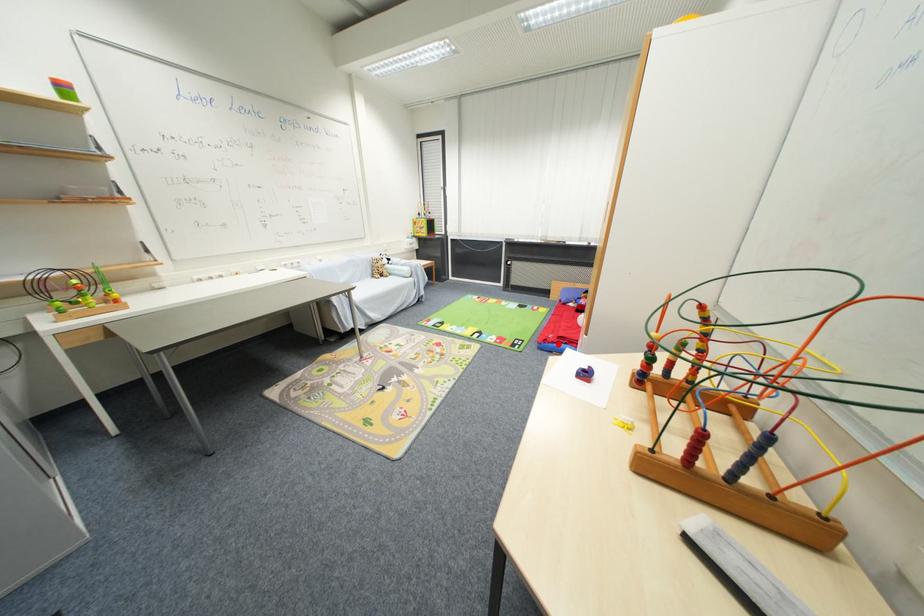
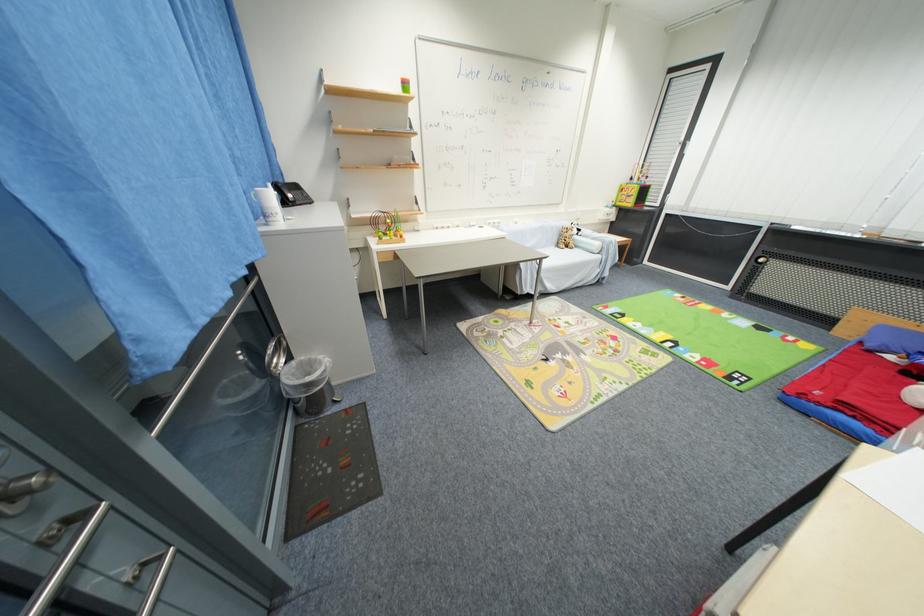
Question: I am providing you with two images of the same scene from different viewpoints. A red point is shown in image1. For the corresponding object point in image2, is it positioned nearer or farther from the camera?

Choices:
 (A) Nearer
 (B) Farther

Answer: (B)